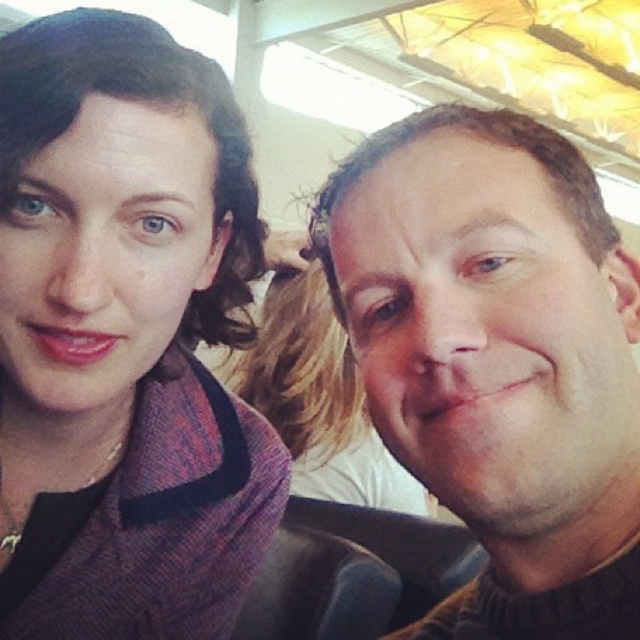
Question: Does matte purple scarf at upper left have a smaller size compared to brown fuzzy sweater at right?

Choices:
 (A) no
 (B) yes

Answer: (A)

Question: Which of the following is the farthest from the observer?

Choices:
 (A) matte purple scarf at upper left
 (B) brown fuzzy sweater at right
 (C) smooth skin face at center

Answer: (C)

Question: Based on their relative distances, which object is nearer to the smooth skin face at center?

Choices:
 (A) brown fuzzy sweater at right
 (B) matte purple scarf at upper left

Answer: (B)

Question: Can you confirm if matte purple scarf at upper left is bigger than smooth skin face at center?

Choices:
 (A) no
 (B) yes

Answer: (A)

Question: Which of the following is the farthest from the observer?

Choices:
 (A) (492, 202)
 (B) (292, 333)

Answer: (B)

Question: Does matte purple scarf at upper left appear over smooth skin face at center?

Choices:
 (A) no
 (B) yes

Answer: (B)